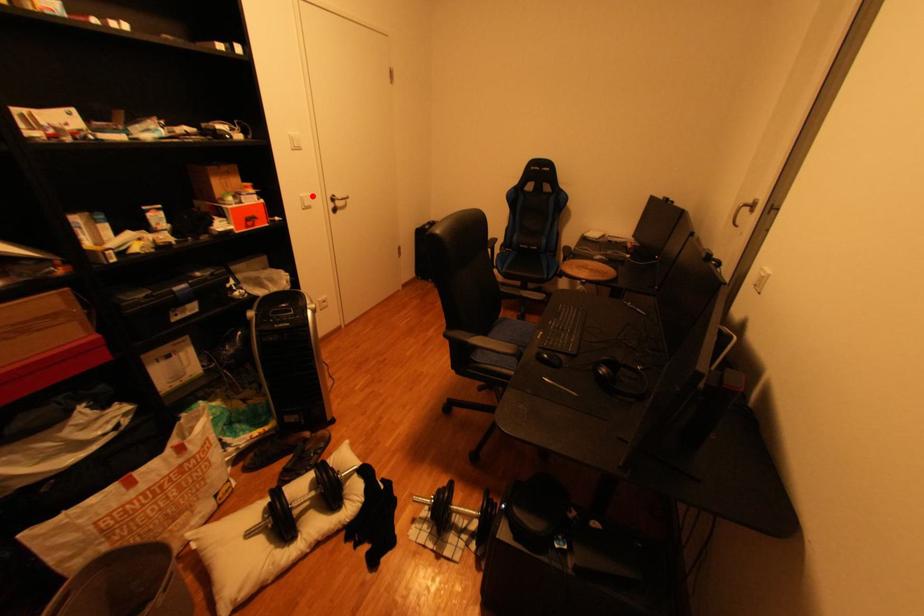
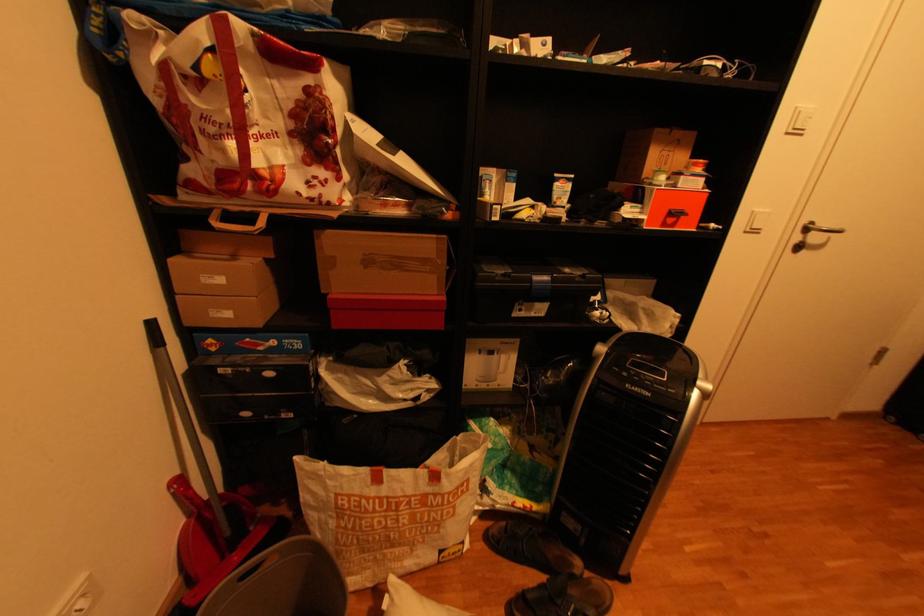
Question: I am providing you with two images of the same scene from different viewpoints. A red point is marked on the first image. Is the red point's position out of view in image 2?

Choices:
 (A) Yes
 (B) No

Answer: (B)